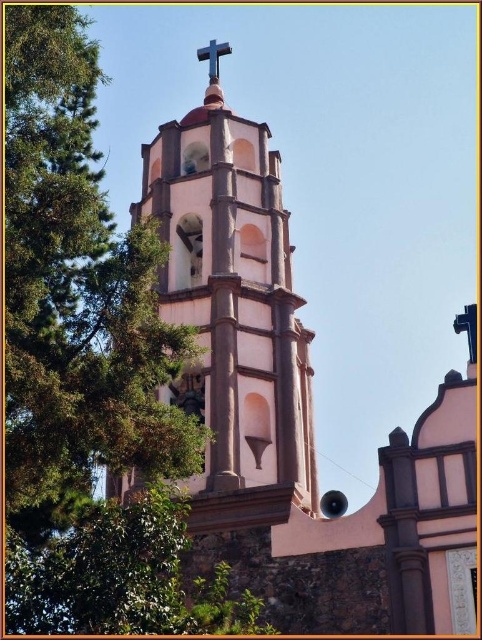
You are standing at the point marked by coordinates point (296, 410) in the church scene. Looking around, you see the pink stucco church tower at center. What direction is the tree located relative to your position?

The tree is to the left of the pink stucco church tower at center, so it is also to the left of your position marked by point (296, 410).

You are standing in front of the church and want to take a photo of both the pink stucco church tower at center and the metallic cross at upper center. However, you notice that the tree to the left is blocking your view. Which object is more likely to be visible through the tree, and why?

The metallic cross at upper center is more likely to be visible because the pink stucco church tower at center is positioned on the right side of it, meaning the cross is closer to the left where the tree is located, potentially allowing parts of it to peek through the foliage while the tower might be more obscured.